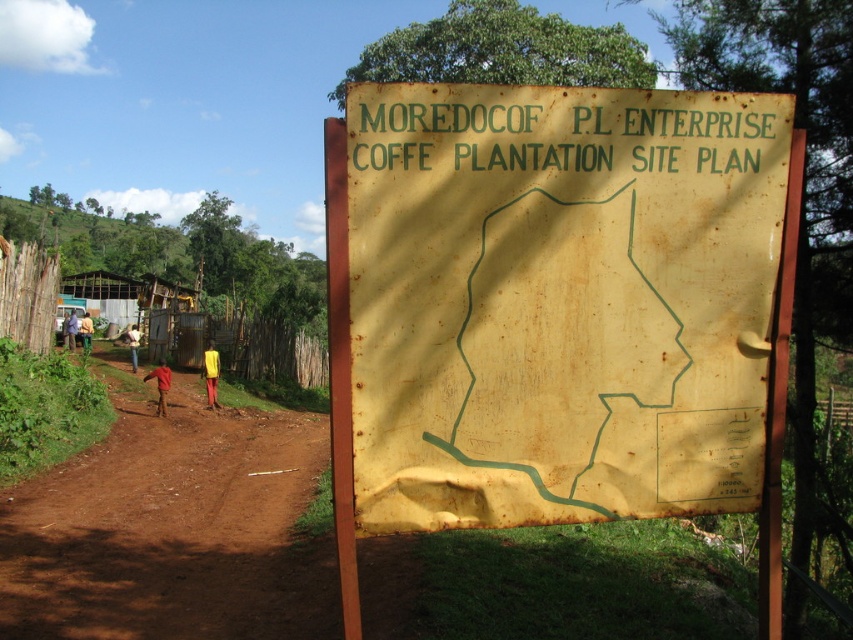
Question: Is red cotton shirt at lower left to the left of yellow shirt at left from the viewer's perspective?

Choices:
 (A) yes
 (B) no

Answer: (B)

Question: Can you confirm if rusty yellow map at center is positioned to the left of brown dirt track at lower left?

Choices:
 (A) yes
 (B) no

Answer: (B)

Question: Which point is farther from the camera taking this photo?

Choices:
 (A) (202, 419)
 (B) (68, 332)
 (C) (715, 401)
 (D) (132, 353)

Answer: (B)

Question: Which object is positioned closest to the yellow shirt at left?

Choices:
 (A) rusty yellow map at center
 (B) yellow fabric shirt at center
 (C) red cotton shirt at lower left
 (D) yellow fabric at center

Answer: (B)

Question: Where is red cotton shirt at lower left located in relation to yellow fabric pants at left in the image?

Choices:
 (A) above
 (B) below

Answer: (B)

Question: Which of the following is the farthest from the observer?

Choices:
 (A) yellow fabric pants at left
 (B) yellow shirt at left
 (C) red cotton shirt at lower left

Answer: (B)